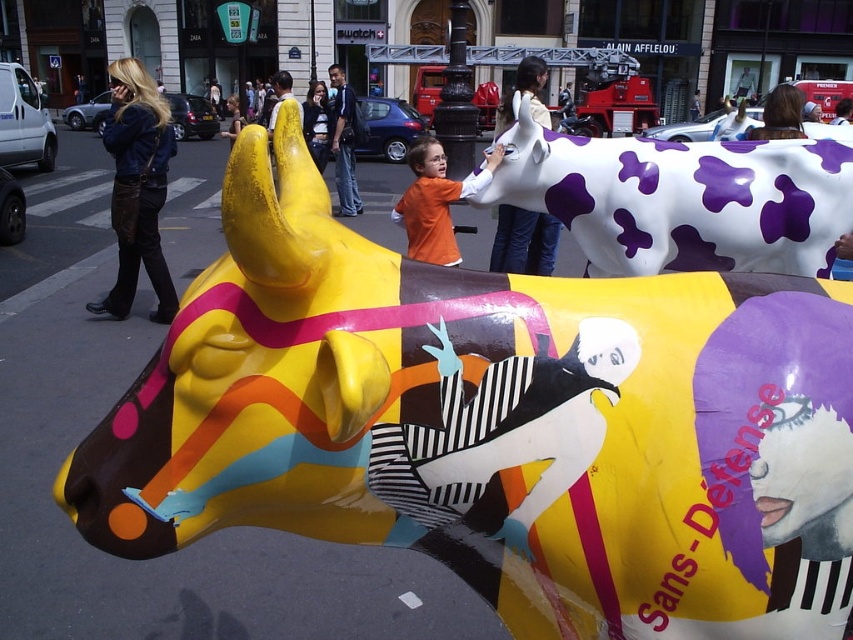
Question: Is brown hair at upper right above matte black jacket at upper center?

Choices:
 (A) no
 (B) yes

Answer: (B)

Question: Which point appears farthest from the camera in this image?

Choices:
 (A) (538, 92)
 (B) (283, 96)
 (C) (523, 161)

Answer: (B)

Question: Does denim jacket at left appear on the right side of matte black jacket at upper center?

Choices:
 (A) no
 (B) yes

Answer: (A)

Question: Which point is farther to the camera?

Choices:
 (A) white glossy cow at center
 (B) brown hair at upper right
 (C) denim jacket at left
 (D) matte white shirt at upper center

Answer: (C)

Question: Considering the real-world distances, which object is farthest from the orange matte shirt at center?

Choices:
 (A) denim jacket at left
 (B) matte black jacket at upper center

Answer: (B)

Question: Can you confirm if white glossy cow at center is bigger than matte white shirt at upper center?

Choices:
 (A) no
 (B) yes

Answer: (A)